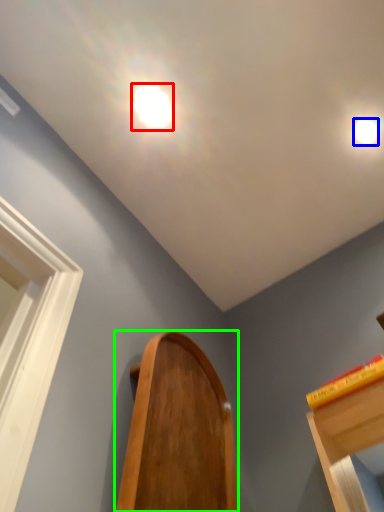
Question: Considering the real-world distances, which object is farthest from droplight (highlighted by a red box)? droplight (highlighted by a blue box) or furniture (highlighted by a green box)?

Choices:
 (A) droplight
 (B) furniture

Answer: (B)